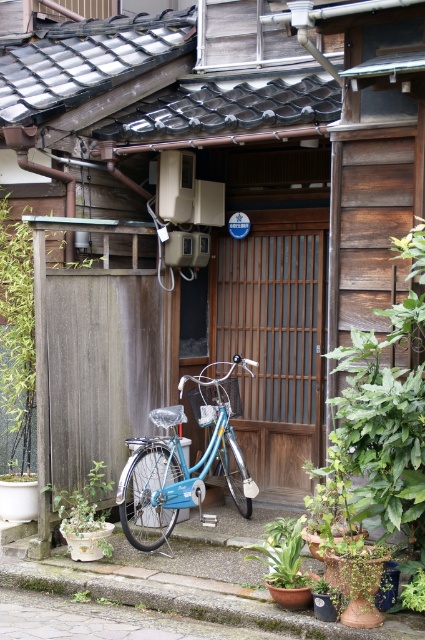
Which is more to the left, matte blue bicycle at lower left or green matte pot at lower left?

green matte pot at lower left is more to the left.

Is matte blue bicycle at lower left thinner than green matte pot at lower left?

Incorrect, matte blue bicycle at lower left's width is not less than green matte pot at lower left's.

Between point (207, 461) and point (67, 508), which one is positioned behind?

The point (207, 461) is more distant.

Find the location of `matte blue bicycle at lower left`. matte blue bicycle at lower left is located at coordinates (184, 464).

Can you confirm if matte blue bicycle at lower left is taller than green wood fence at left?

Incorrect, matte blue bicycle at lower left's height is not larger of green wood fence at left's.

Is matte blue bicycle at lower left to the left of green wood fence at left from the viewer's perspective?

Incorrect, matte blue bicycle at lower left is not on the left side of green wood fence at left.

Which is in front, point (161, 531) or point (2, 288)?

Point (2, 288) is in front.

Where is `matte blue bicycle at lower left`? matte blue bicycle at lower left is located at coordinates (184, 464).

Measure the distance between point [28,264] and camera.

27.46 feet

Which of these two, green wood fence at left or green leafy plant at lower center, stands shorter?

green leafy plant at lower center is shorter.

Between point (25, 429) and point (280, 524), which one is positioned behind?

Point (25, 429)

Locate an element on the screen. This screenshot has width=425, height=640. green wood fence at left is located at coordinates (17, 332).